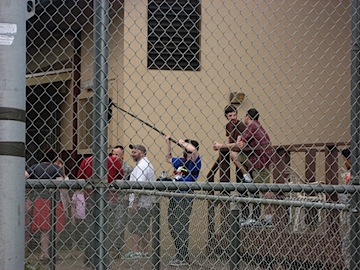
Find the location of a particular element. This screenshot has height=270, width=360. black vent is located at coordinates (183, 33).